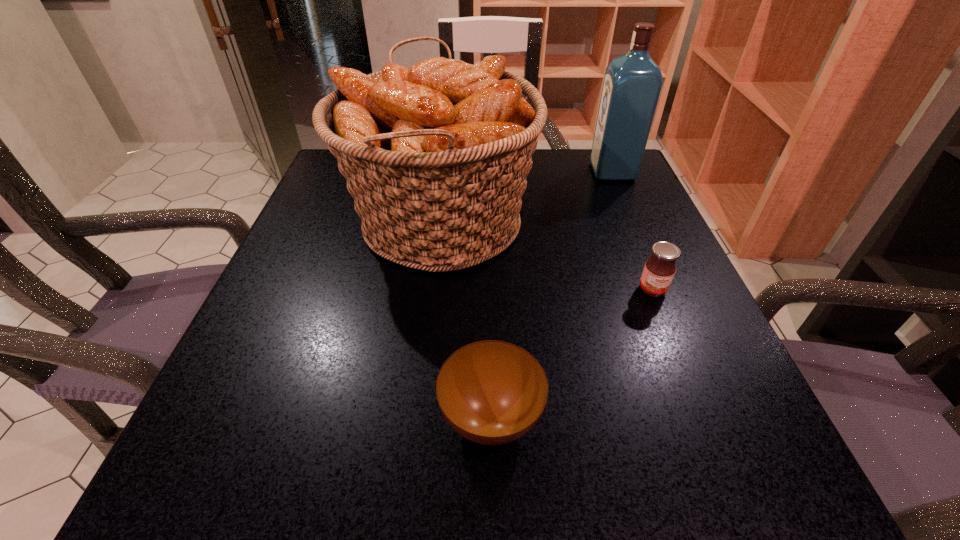
The image size is (960, 540). Identify the location of empty location between the shortest object and the basket. (466, 320).

Where is `vacant area that lies between the bowl and the liquor`? Image resolution: width=960 pixels, height=540 pixels. vacant area that lies between the bowl and the liquor is located at coordinates click(x=552, y=294).

What are the coordinates of `empty location between the nearest object and the liquor` in the screenshot? It's located at (552, 294).

You are a GUI agent. You are given a task and a screenshot of the screen. Output one action in this format:
    pyautogui.click(x=<x>, y=<y>)
    Task: Click on the vacant region between the basket and the liquor
    Image resolution: width=960 pixels, height=540 pixels.
    Given the screenshot: What is the action you would take?
    pyautogui.click(x=526, y=198)

Where is `object identified as the second closest to the bowl`? object identified as the second closest to the bowl is located at coordinates (659, 270).

Select which object appears as the second closest to the nearest object. Please provide its 2D coordinates. Your answer should be formatted as a tuple, i.e. [(x, y)], where the tuple contains the x and y coordinates of a point satisfying the conditions above.

[(659, 270)]

The width and height of the screenshot is (960, 540). Identify the location of vacant space that satisfies the following two spatial constraints: 1. on the flat label side of the liquor; 2. on the label side of the jam. (663, 290).

Find the location of a particular element. This screenshot has height=540, width=960. vacant region that satisfies the following two spatial constraints: 1. on the flat label side of the liquor; 2. on the label side of the jam is located at coordinates (663, 290).

Where is `vacant space that satisfies the following two spatial constraints: 1. on the front side of the basket; 2. on the right side of the shortest object`? This screenshot has width=960, height=540. vacant space that satisfies the following two spatial constraints: 1. on the front side of the basket; 2. on the right side of the shortest object is located at coordinates (420, 417).

Identify the location of vacant area that satisfies the following two spatial constraints: 1. on the flat label side of the liquor; 2. on the label side of the jam. (663, 290).